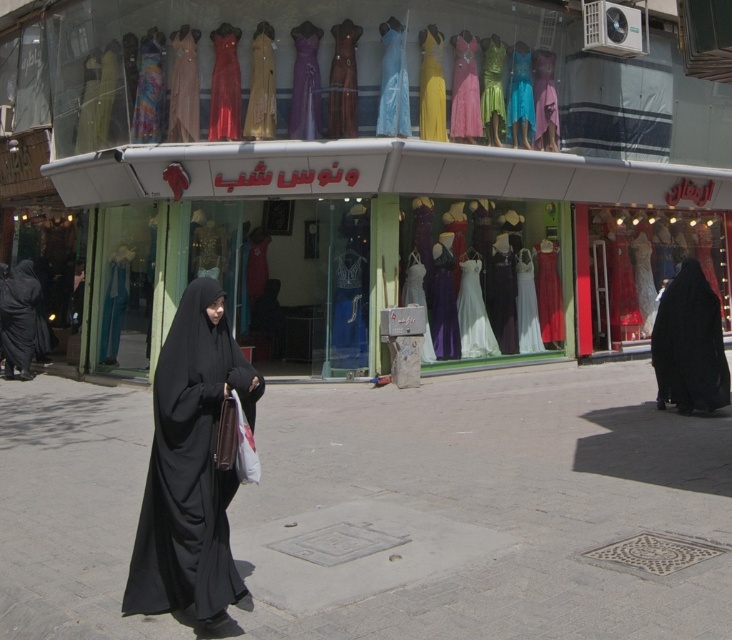
Is point (470, 131) positioned before point (482, 113)?

Yes.

Can you confirm if pink satin dress at center is bigger than green satin dress at center?

Correct, pink satin dress at center is larger in size than green satin dress at center.

Between point (466, 104) and point (492, 99), which one is positioned behind?

Point (492, 99)

Where is `pink satin dress at center`? The image size is (732, 640). pink satin dress at center is located at coordinates (463, 90).

Between silky satin dresses at center and white satin dress at center, which one has more height?

Standing taller between the two is silky satin dresses at center.

Is point (638, 227) less distant than point (477, 340)?

That is False.

This screenshot has height=640, width=732. Identify the location of silky satin dresses at center. point(359,172).

Can you confirm if yellow satin dress at center is positioned to the right of matte blue dress at center?

In fact, yellow satin dress at center is to the left of matte blue dress at center.

Is point (430, 33) in front of point (529, 106)?

Yes, it is in front of point (529, 106).

This screenshot has height=640, width=732. What are the coordinates of `yellow satin dress at center` in the screenshot? It's located at (430, 84).